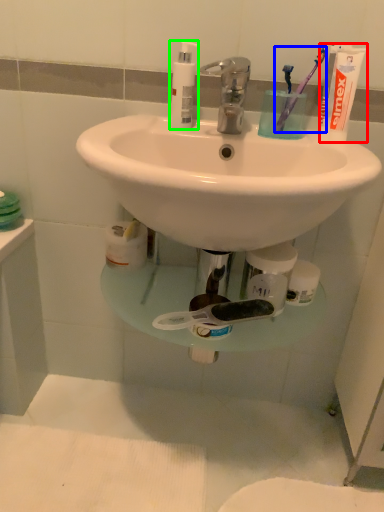
Question: Estimate the real-world distances between objects in this image. Which object is closer to toothpaste (highlighted by a red box), toothbrush (highlighted by a blue box) or soap dispenser (highlighted by a green box)?

Choices:
 (A) toothbrush
 (B) soap dispenser

Answer: (A)